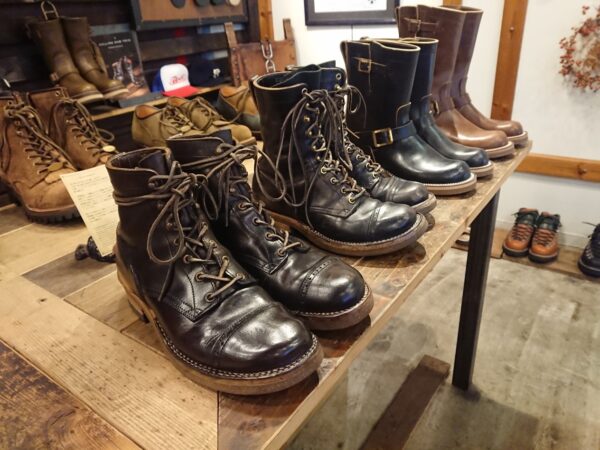
This screenshot has width=600, height=450. I want to click on table, so click(x=75, y=356), click(x=245, y=164), click(x=417, y=251).